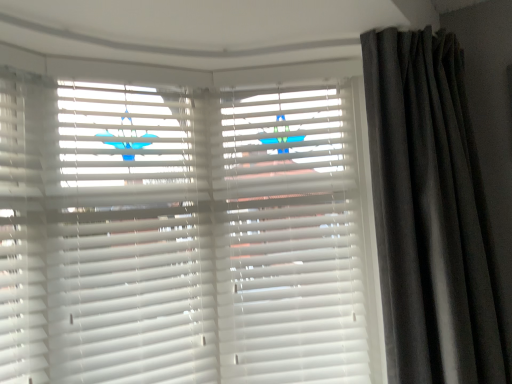
Question: Can you confirm if dark grey velvet curtain at right is smaller than white matte blinds at center, placed as the 2th shutter when sorted from right to left?

Choices:
 (A) no
 (B) yes

Answer: (A)

Question: Is dark grey velvet curtain at right thinner than white matte blinds at center, the first shutter positioned from the left?

Choices:
 (A) no
 (B) yes

Answer: (A)

Question: From the image's perspective, is dark grey velvet curtain at right located beneath white matte blinds at center, the first shutter positioned from the left?

Choices:
 (A) yes
 (B) no

Answer: (B)

Question: Is dark grey velvet curtain at right shorter than white matte blinds at center, placed as the 2th shutter when sorted from right to left?

Choices:
 (A) no
 (B) yes

Answer: (A)

Question: Is dark grey velvet curtain at right wider than white matte blinds at center, the first shutter positioned from the left?

Choices:
 (A) no
 (B) yes

Answer: (B)

Question: Do you think white matte blinds at center, placed as the 2th shutter when sorted from right to left, is within white matte shutter at center, positioned as the second shutter in left-to-right order, or outside of it?

Choices:
 (A) inside
 (B) outside

Answer: (B)

Question: Considering the positions of white matte blinds at center, the first shutter positioned from the left, and white matte shutter at center, positioned as the second shutter in left-to-right order, in the image, is white matte blinds at center, the first shutter positioned from the left, taller or shorter than white matte shutter at center, positioned as the second shutter in left-to-right order,?

Choices:
 (A) tall
 (B) short

Answer: (B)

Question: Is white matte blinds at center, the first shutter positioned from the left, wider or thinner than white matte shutter at center, the first shutter when ordered from right to left?

Choices:
 (A) thin
 (B) wide

Answer: (A)

Question: From a real-world perspective, is white matte blinds at center, placed as the 2th shutter when sorted from right to left, physically located above or below white matte shutter at center, the first shutter when ordered from right to left?

Choices:
 (A) below
 (B) above

Answer: (B)

Question: Relative to white matte blinds at center, placed as the 2th shutter when sorted from right to left, is white matte shutter at center, positioned as the second shutter in left-to-right order, in front or behind?

Choices:
 (A) front
 (B) behind

Answer: (B)

Question: Looking at the image, does white matte shutter at center, positioned as the second shutter in left-to-right order, seem bigger or smaller compared to white matte blinds at center, the first shutter positioned from the left?

Choices:
 (A) big
 (B) small

Answer: (A)

Question: From a real-world perspective, relative to white matte blinds at center, placed as the 2th shutter when sorted from right to left, is white matte shutter at center, positioned as the second shutter in left-to-right order, vertically above or below?

Choices:
 (A) above
 (B) below

Answer: (B)

Question: Considering the positions of point click(339, 281) and point click(139, 321), is point click(339, 281) closer or farther from the camera than point click(139, 321)?

Choices:
 (A) farther
 (B) closer

Answer: (A)

Question: From a real-world perspective, is white matte blinds at center, the first shutter positioned from the left, physically located above or below dark grey velvet curtain at right?

Choices:
 (A) below
 (B) above

Answer: (B)

Question: Considering the positions of white matte blinds at center, the first shutter positioned from the left, and dark grey velvet curtain at right in the image, is white matte blinds at center, the first shutter positioned from the left, bigger or smaller than dark grey velvet curtain at right?

Choices:
 (A) big
 (B) small

Answer: (B)